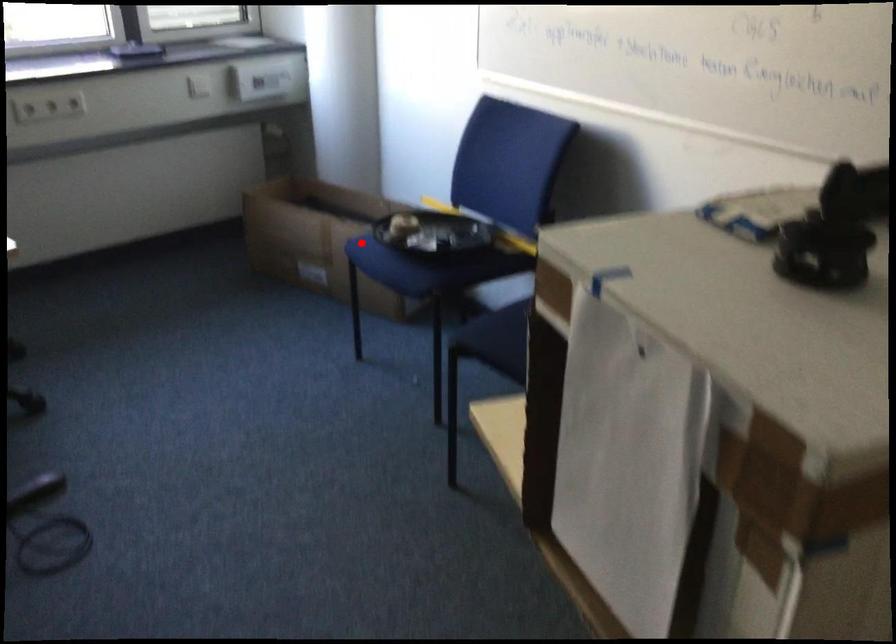
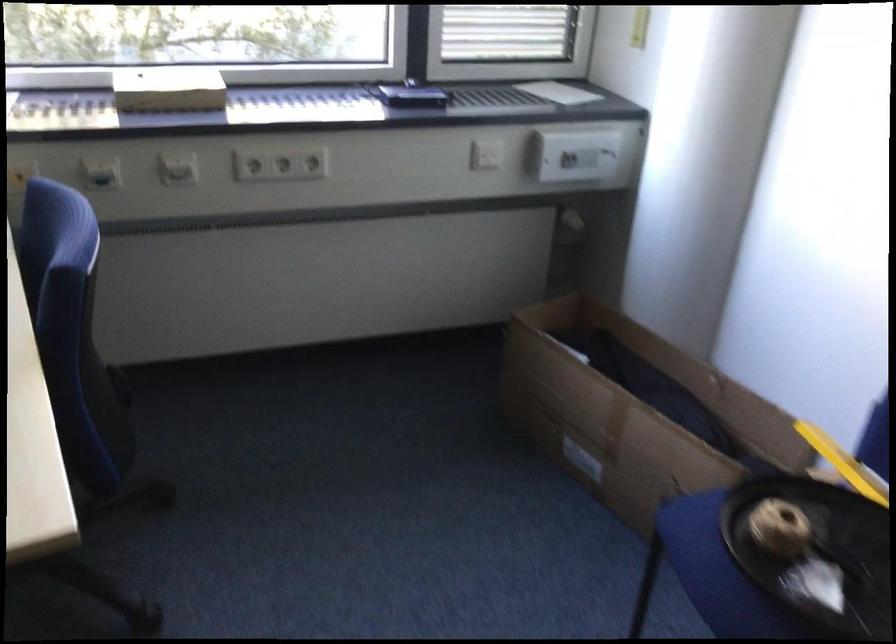
Locate, in the second image, the point that corresponds to the highlighted location in the first image.

(695, 527)